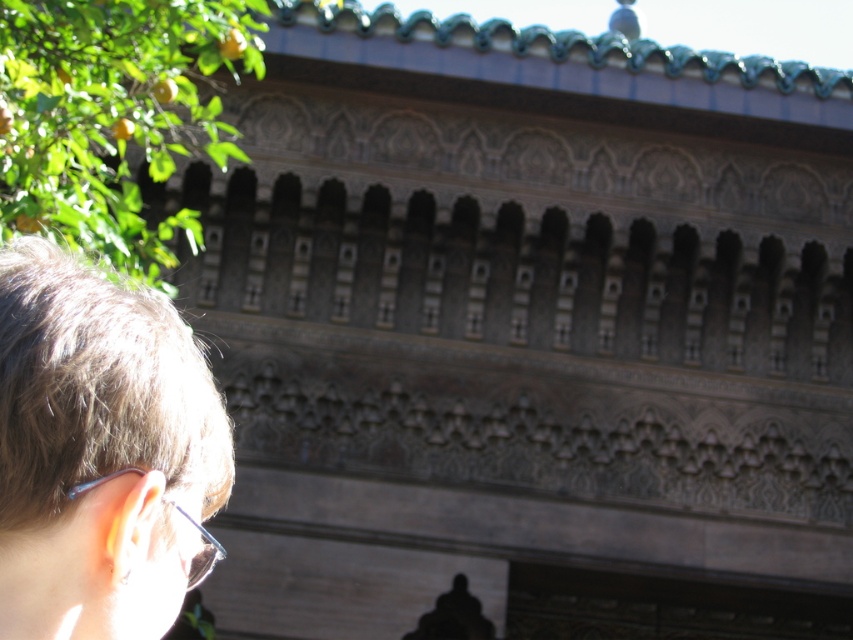
Question: Can you confirm if brown hair at left is positioned to the right of clear plastic glasses at lower left?

Choices:
 (A) no
 (B) yes

Answer: (B)

Question: Can you confirm if brown hair at left is positioned to the left of clear plastic glasses at lower left?

Choices:
 (A) no
 (B) yes

Answer: (A)

Question: Among these objects, which one is farthest from the camera?

Choices:
 (A) green leafy tree at upper left
 (B) brown hair at left

Answer: (A)

Question: Which object is closer to the camera taking this photo?

Choices:
 (A) brown hair at left
 (B) clear plastic glasses at lower left
 (C) green leafy tree at upper left

Answer: (A)

Question: Does brown hair at left have a lesser width compared to green leafy tree at upper left?

Choices:
 (A) no
 (B) yes

Answer: (B)

Question: Which point is farther to the camera?

Choices:
 (A) (67, 618)
 (B) (125, 154)
 (C) (190, 557)

Answer: (B)